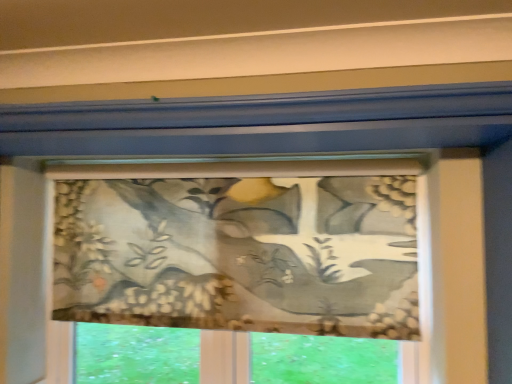
The image size is (512, 384). Identify the location of textured floral fabric at center. (240, 254).

What do you see at coordinates (240, 254) in the screenshot?
I see `textured floral fabric at center` at bounding box center [240, 254].

At what (x,y) coordinates should I click in order to perform the action: click on textured floral fabric at center. Please return your answer as a coordinate pair (x, y). The width and height of the screenshot is (512, 384). Looking at the image, I should click on coord(240,254).